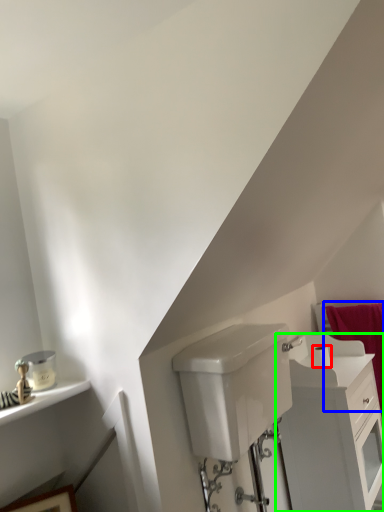
Question: Which object is positioned closest to toilet paper (highlighted by a red box)? Select from bath towel (highlighted by a blue box) and bathroom cabinet (highlighted by a green box).

Choices:
 (A) bath towel
 (B) bathroom cabinet

Answer: (B)